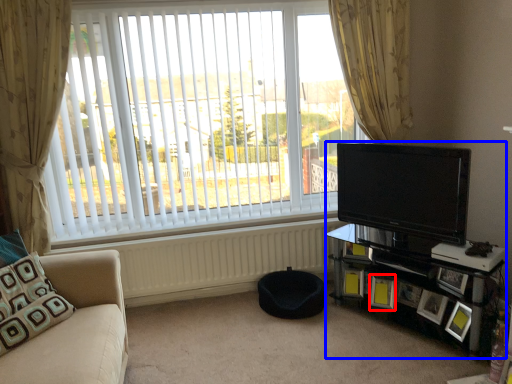
Question: Which object appears closest to the camera in this image, picture frame (highlighted by a red box) or entertainment center (highlighted by a blue box)?

Choices:
 (A) picture frame
 (B) entertainment center

Answer: (B)